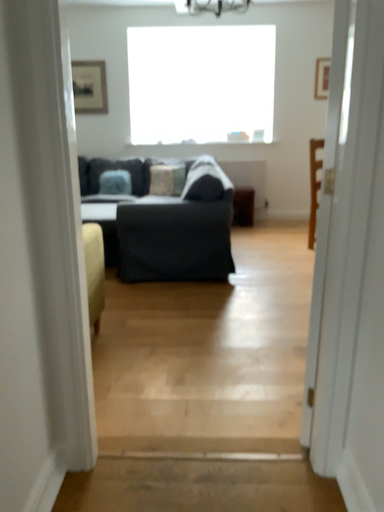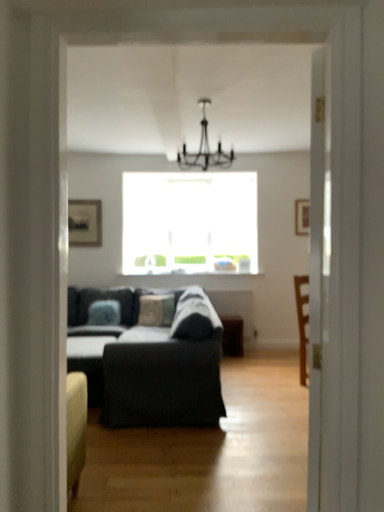
Question: How did the camera likely rotate when shooting the video?

Choices:
 (A) rotated downward
 (B) rotated upward

Answer: (B)